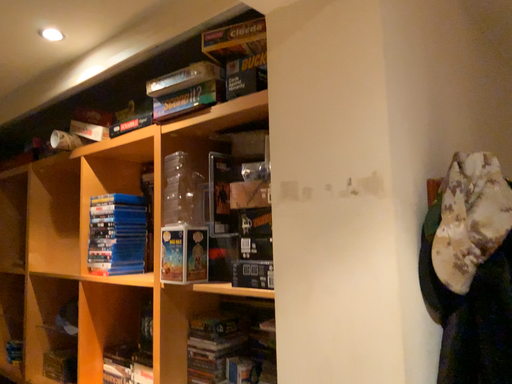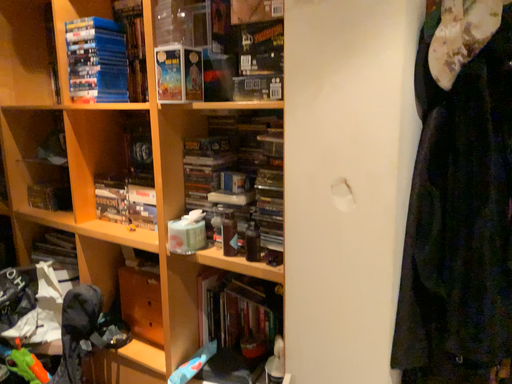
Question: Which way did the camera rotate in the video?

Choices:
 (A) rotated downward
 (B) rotated upward

Answer: (A)